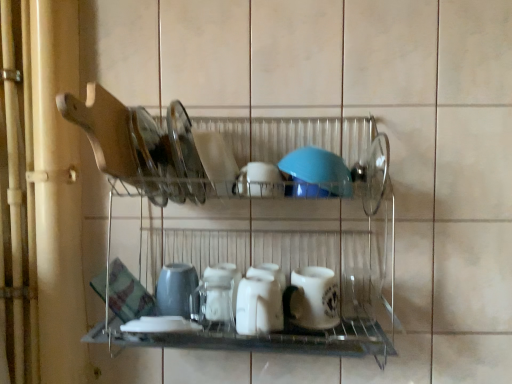
Question: Is white matte mug at center, placed as the 2th tableware when sorted from right to left, at the right side of blue rubber lid at center, the 1th tableware positioned from the right?

Choices:
 (A) no
 (B) yes

Answer: (A)

Question: Is white matte mug at center, placed as the 2th tableware when sorted from right to left, wider than blue rubber lid at center, the 1th tableware positioned from the right?

Choices:
 (A) no
 (B) yes

Answer: (A)

Question: Is the position of white matte mug at center, placed as the 2th tableware when sorted from right to left, more distant than that of blue rubber lid at center, the 1th tableware positioned from the right?

Choices:
 (A) no
 (B) yes

Answer: (B)

Question: Can we say white matte mug at center, positioned as the 5th tableware in left-to-right order, lies outside blue rubber lid at center, the 1th tableware positioned from the right?

Choices:
 (A) yes
 (B) no

Answer: (A)

Question: Can you confirm if white matte mug at center, placed as the 2th tableware when sorted from right to left, is taller than blue rubber lid at center, which appears as the 6th tableware when viewed from the left?

Choices:
 (A) no
 (B) yes

Answer: (B)

Question: Is white matte mug at center, positioned as the 5th tableware in left-to-right order, shorter than blue rubber lid at center, the 1th tableware positioned from the right?

Choices:
 (A) yes
 (B) no

Answer: (B)

Question: From a real-world perspective, is matte gray cup at center on top of white glossy bowl at center, the 2th tableware when ordered from left to right?

Choices:
 (A) yes
 (B) no

Answer: (B)

Question: Is matte gray cup at center to the right of white glossy bowl at center, the 2th tableware when ordered from left to right, from the viewer's perspective?

Choices:
 (A) no
 (B) yes

Answer: (A)

Question: Considering the relative sizes of matte gray cup at center and white glossy bowl at center, which is counted as the fifth tableware, starting from the right, in the image provided, is matte gray cup at center smaller than white glossy bowl at center, which is counted as the fifth tableware, starting from the right,?

Choices:
 (A) yes
 (B) no

Answer: (A)

Question: From the image's perspective, does matte gray cup at center appear lower than white glossy bowl at center, the 2th tableware when ordered from left to right?

Choices:
 (A) yes
 (B) no

Answer: (A)

Question: Can you confirm if matte gray cup at center is taller than white glossy bowl at center, the 2th tableware when ordered from left to right?

Choices:
 (A) yes
 (B) no

Answer: (B)

Question: Considering the relative sizes of matte gray cup at center and white glossy bowl at center, the 2th tableware when ordered from left to right, in the image provided, is matte gray cup at center wider than white glossy bowl at center, the 2th tableware when ordered from left to right,?

Choices:
 (A) yes
 (B) no

Answer: (B)

Question: Is blue rubber lid at center, the 1th tableware positioned from the right, surrounding matte gray cup at center?

Choices:
 (A) yes
 (B) no

Answer: (B)